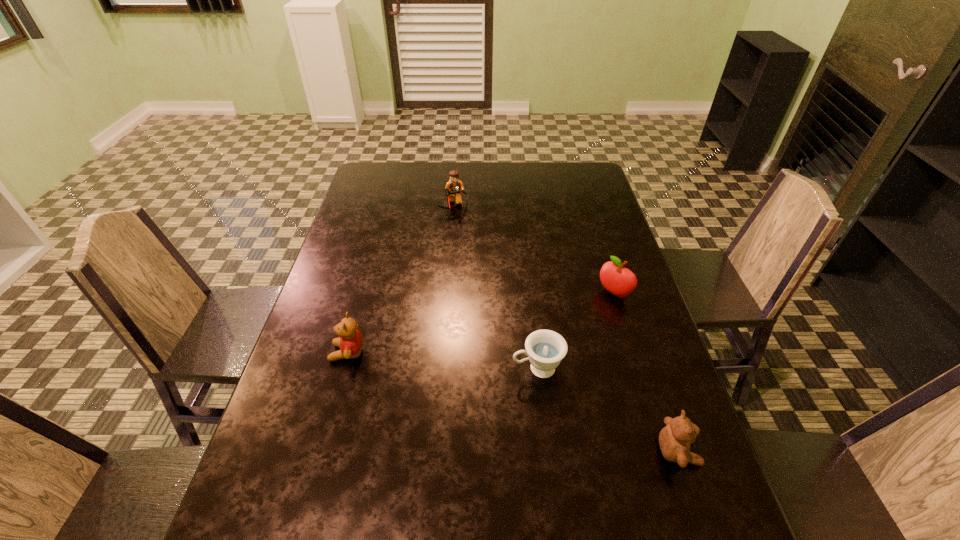
In order to click on vacant space that is in between the apple and the farther teddy bear in this screenshot , I will do `click(481, 323)`.

I want to click on free space between the shortest object and the fourth object from right to left, so click(495, 288).

This screenshot has height=540, width=960. Identify the location of free area in between the farther teddy bear and the farthest object. (400, 280).

Locate an element on the screen. vacant point located between the shortest object and the nearer teddy bear is located at coordinates (608, 410).

Locate an element on the screen. free spot between the second object from left to right and the second farthest object is located at coordinates (534, 250).

This screenshot has width=960, height=540. Identify the location of unoccupied area between the farthest object and the shortest object. (495, 288).

At what (x,y) coordinates should I click in order to perform the action: click on vacant area between the teacup and the nearest object. Please return your answer as a coordinate pair (x, y). Image resolution: width=960 pixels, height=540 pixels. Looking at the image, I should click on (608, 410).

This screenshot has height=540, width=960. Identify the location of free area in between the right teddy bear and the Lego. (565, 329).

The image size is (960, 540). I want to click on free space between the farthest object and the nearest object, so click(565, 329).

Find the location of `the fourth closest object to the right teddy bear`. the fourth closest object to the right teddy bear is located at coordinates (454, 188).